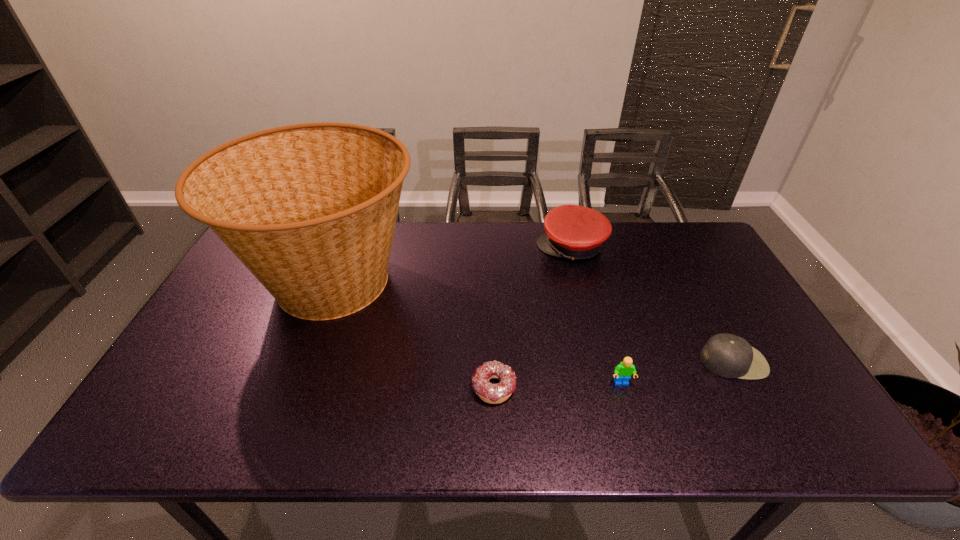
Where is `vacant space located 0.320m on the front of the left cap with an emblem`? This screenshot has height=540, width=960. vacant space located 0.320m on the front of the left cap with an emblem is located at coordinates (442, 247).

Identify the location of vacant space located on the front of the left cap with an emblem. (474, 247).

Locate an element on the screen. vacant space located on the front of the left cap with an emblem is located at coordinates (508, 247).

At what (x,y) coordinates should I click in order to perform the action: click on vacant space located 0.080m on the face of the Lego. Please return your answer as a coordinate pair (x, y). Looking at the image, I should click on (632, 418).

Where is `vacant space situated on the brim of the right cap`? This screenshot has height=540, width=960. vacant space situated on the brim of the right cap is located at coordinates (769, 429).

Image resolution: width=960 pixels, height=540 pixels. I want to click on free space located on the left of the shortest object, so click(x=355, y=387).

This screenshot has width=960, height=540. In order to click on basket located at the far edge in this screenshot , I will do `click(310, 209)`.

This screenshot has width=960, height=540. Find the location of `cap that is at the far edge`. cap that is at the far edge is located at coordinates (574, 232).

Where is `object that is at the left edge`? The image size is (960, 540). object that is at the left edge is located at coordinates (310, 209).

Where is `object that is at the right edge`? The width and height of the screenshot is (960, 540). object that is at the right edge is located at coordinates (729, 356).